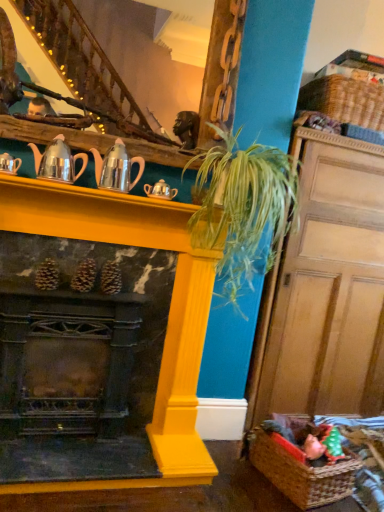
Question: Does point (139, 242) appear closer or farther from the camera than point (137, 112)?

Choices:
 (A) farther
 (B) closer

Answer: (B)

Question: Is yellow painted wood fireplace at center spatially inside wooden staircase at upper center, or outside of it?

Choices:
 (A) outside
 (B) inside

Answer: (A)

Question: Which object is the closest to the yellow painted wood fireplace at center?

Choices:
 (A) wooden staircase at upper center
 (B) shiny silver teapot at upper left, which is counted as the second tea pot, starting from the left
 (C) brown woven basket at lower right, arranged as the first basket when viewed from the front
 (D) green leafy plant at center
 (E) woven brown basket at upper right, which appears as the first basket when viewed from the top

Answer: (D)

Question: Which of these objects is positioned closest to the metallic silver teapot at upper left, acting as the 1th tea pot starting from the left?

Choices:
 (A) shiny silver teapot at upper left, which is the 3th tea pot in right-to-left order
 (B) yellow painted wood fireplace at center
 (C) woven brown basket at upper right, which appears as the first basket when viewed from the top
 (D) brown woven basket at lower right, which is the 2th basket in top-to-bottom order
 (E) shiny metallic teapot at center, which is the 3th tea pot in left-to-right order

Answer: (A)